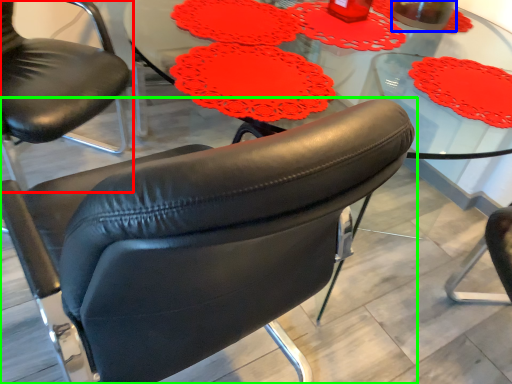
Question: Based on their relative distances, which object is farther from chair (highlighted by a red box)? Choose from beverage (highlighted by a blue box) and chair (highlighted by a green box).

Choices:
 (A) beverage
 (B) chair

Answer: (A)